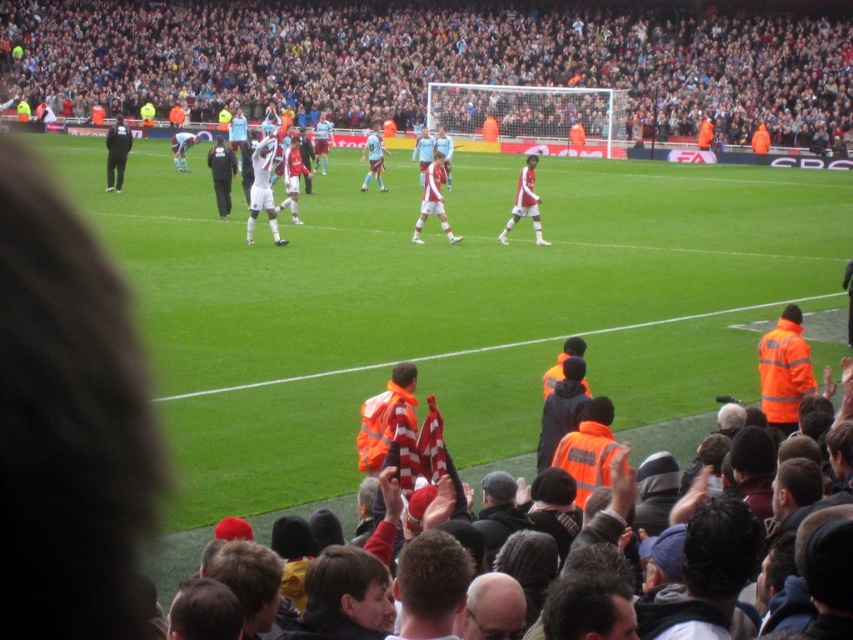
Can you confirm if matte white shorts at center is bigger than white matte soccer player at center?

Actually, matte white shorts at center might be smaller than white matte soccer player at center.

Describe the element at coordinates (434, 198) in the screenshot. I see `matte white shorts at center` at that location.

Where is `matte white shorts at center`? This screenshot has width=853, height=640. matte white shorts at center is located at coordinates (434, 198).

Is point (219, 4) farther from viewer compared to point (378, 132)?

Yes, point (219, 4) is behind point (378, 132).

Between dark gray crowd at upper center and light blue jersey at center, which one is positioned higher?

dark gray crowd at upper center is above.

Is point (753, 112) farther from camera compared to point (378, 186)?

Yes, it is.

I want to click on dark gray crowd at upper center, so click(x=434, y=60).

From the picture: Which of these two, matte white shorts at center or light blue jersey at center, stands shorter?

matte white shorts at center

Which is behind, point (424, 204) or point (375, 156)?

Positioned behind is point (375, 156).

Where is `matte white shorts at center`? This screenshot has width=853, height=640. matte white shorts at center is located at coordinates (434, 198).